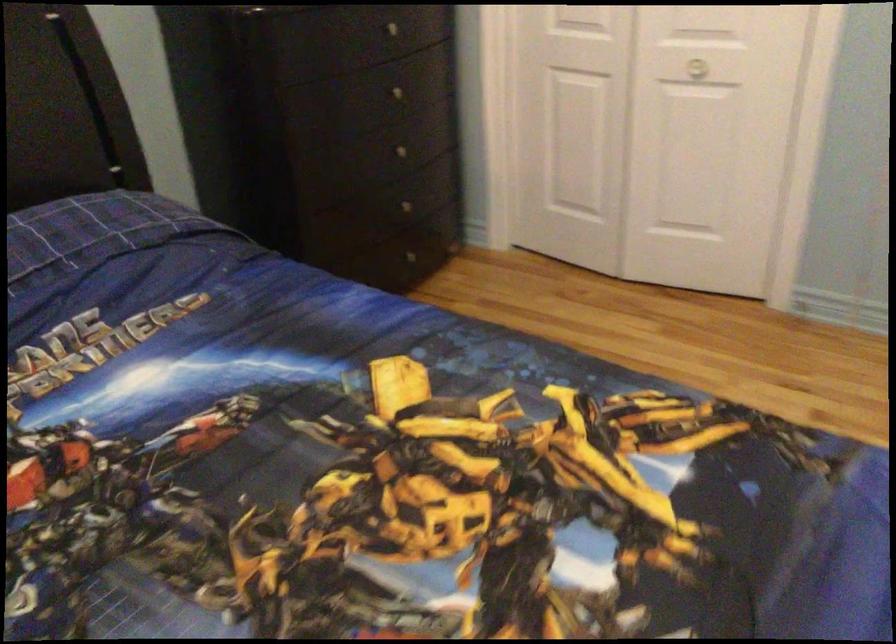
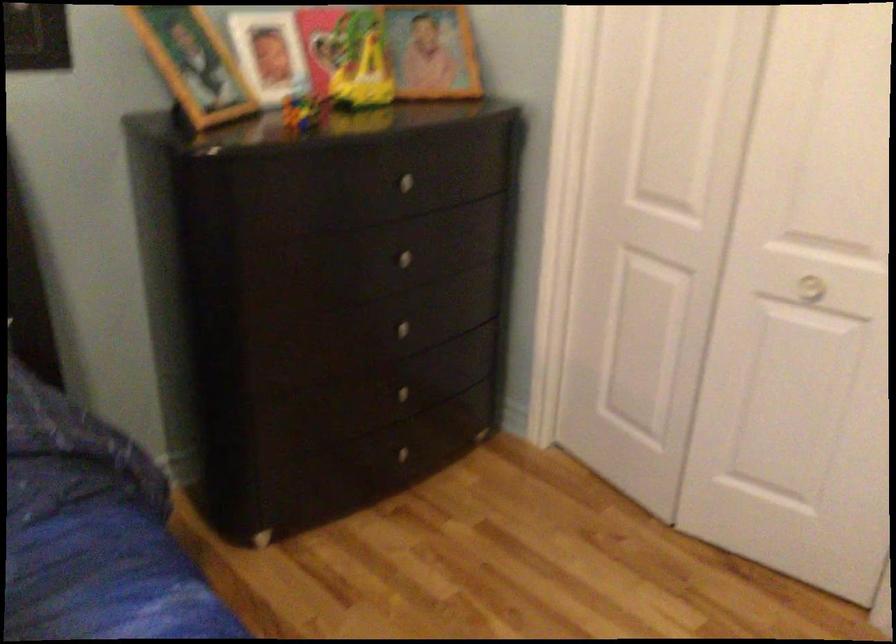
Find the pixel in the second image that matches [406,207] in the first image.

(400, 393)